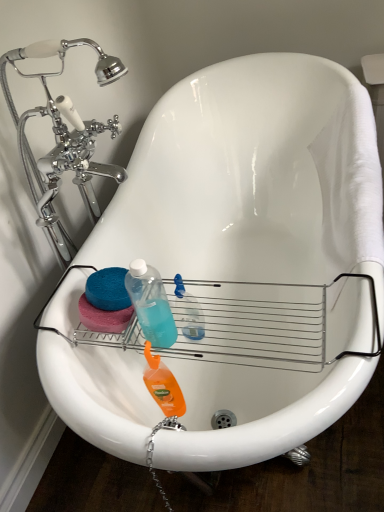
Where is `orange matte liquid at center, which is the second cleaning product in top-to-bottom order`? orange matte liquid at center, which is the second cleaning product in top-to-bottom order is located at coordinates (163, 385).

Describe the element at coordinates (163, 385) in the screenshot. I see `orange matte liquid at center, which is the first cleaning product from bottom to top` at that location.

Find the location of a particular element. Image resolution: width=384 pixels, height=512 pixels. translucent plastic bottle at center, marked as the 1th cleaning product in a top-to-bottom arrangement is located at coordinates (187, 312).

What do you see at coordinates (187, 312) in the screenshot?
I see `translucent plastic bottle at center, the 2th cleaning product in the bottom-to-top sequence` at bounding box center [187, 312].

Locate an element on the screen. Image resolution: width=384 pixels, height=512 pixels. orange matte liquid at center, which is the first cleaning product from bottom to top is located at coordinates (163, 385).

Considering the relative positions of translucent plastic bottle at center, the 2th cleaning product in the bottom-to-top sequence, and orange matte liquid at center, which is the first cleaning product from bottom to top, in the image provided, is translucent plastic bottle at center, the 2th cleaning product in the bottom-to-top sequence, to the right of orange matte liquid at center, which is the first cleaning product from bottom to top, from the viewer's perspective?

Yes, translucent plastic bottle at center, the 2th cleaning product in the bottom-to-top sequence, is to the right of orange matte liquid at center, which is the first cleaning product from bottom to top.

From the picture: Between translucent plastic bottle at center, the 2th cleaning product in the bottom-to-top sequence, and orange matte liquid at center, which is the first cleaning product from bottom to top, which one is positioned behind?

translucent plastic bottle at center, the 2th cleaning product in the bottom-to-top sequence.

Considering the positions of points (174, 298) and (159, 362), is point (174, 298) farther from camera compared to point (159, 362)?

No.

From the image's perspective, between translucent plastic bottle at center, the 2th cleaning product in the bottom-to-top sequence, and orange matte liquid at center, which is the second cleaning product in top-to-bottom order, which one is located above?

From the image's view, translucent plastic bottle at center, the 2th cleaning product in the bottom-to-top sequence, is above.

From a real-world perspective, is translucent plastic bottle at center, marked as the 1th cleaning product in a top-to-bottom arrangement, physically located above or below orange matte liquid at center, which is the second cleaning product in top-to-bottom order?

In terms of real-world spatial position, translucent plastic bottle at center, marked as the 1th cleaning product in a top-to-bottom arrangement, is above orange matte liquid at center, which is the second cleaning product in top-to-bottom order.

Is translucent plastic bottle at center, the 2th cleaning product in the bottom-to-top sequence, thinner than orange matte liquid at center, which is the second cleaning product in top-to-bottom order?

No, translucent plastic bottle at center, the 2th cleaning product in the bottom-to-top sequence, is not thinner than orange matte liquid at center, which is the second cleaning product in top-to-bottom order.

Is translucent plastic bottle at center, the 2th cleaning product in the bottom-to-top sequence, shorter than orange matte liquid at center, which is the first cleaning product from bottom to top?

Yes, translucent plastic bottle at center, the 2th cleaning product in the bottom-to-top sequence, is shorter than orange matte liquid at center, which is the first cleaning product from bottom to top.

Considering the sizes of objects translucent plastic bottle at center, the 2th cleaning product in the bottom-to-top sequence, and orange matte liquid at center, which is the first cleaning product from bottom to top, in the image provided, who is bigger, translucent plastic bottle at center, the 2th cleaning product in the bottom-to-top sequence, or orange matte liquid at center, which is the first cleaning product from bottom to top,?

With larger size is orange matte liquid at center, which is the first cleaning product from bottom to top.

Is orange matte liquid at center, which is the second cleaning product in top-to-bottom order, completely or partially inside translucent plastic bottle at center, the 2th cleaning product in the bottom-to-top sequence?

No.

Are translucent plastic bottle at center, marked as the 1th cleaning product in a top-to-bottom arrangement, and orange matte liquid at center, which is the first cleaning product from bottom to top, making contact?

No, translucent plastic bottle at center, marked as the 1th cleaning product in a top-to-bottom arrangement, is not next to orange matte liquid at center, which is the first cleaning product from bottom to top.

Is translucent plastic bottle at center, the 2th cleaning product in the bottom-to-top sequence, positioned with its back to orange matte liquid at center, which is the second cleaning product in top-to-bottom order?

That's not correct — translucent plastic bottle at center, the 2th cleaning product in the bottom-to-top sequence, is not looking away from orange matte liquid at center, which is the second cleaning product in top-to-bottom order.

How many degrees apart are the facing directions of translucent plastic bottle at center, marked as the 1th cleaning product in a top-to-bottom arrangement, and orange matte liquid at center, which is the second cleaning product in top-to-bottom order?

The angular difference between translucent plastic bottle at center, marked as the 1th cleaning product in a top-to-bottom arrangement, and orange matte liquid at center, which is the second cleaning product in top-to-bottom order, is 0.00082 degrees.

How distant is translucent plastic bottle at center, marked as the 1th cleaning product in a top-to-bottom arrangement, from orange matte liquid at center, which is the first cleaning product from bottom to top?

The distance of translucent plastic bottle at center, marked as the 1th cleaning product in a top-to-bottom arrangement, from orange matte liquid at center, which is the first cleaning product from bottom to top, is 7.06 inches.

The image size is (384, 512). Find the location of `cleaning product above the orange matte liquid at center, which is the first cleaning product from bottom to top (from a real-world perspective)`. cleaning product above the orange matte liquid at center, which is the first cleaning product from bottom to top (from a real-world perspective) is located at coordinates (187, 312).

Considering the positions of objects orange matte liquid at center, which is the first cleaning product from bottom to top, and translucent plastic bottle at center, marked as the 1th cleaning product in a top-to-bottom arrangement, in the image provided, who is more to the left, orange matte liquid at center, which is the first cleaning product from bottom to top, or translucent plastic bottle at center, marked as the 1th cleaning product in a top-to-bottom arrangement,?

orange matte liquid at center, which is the first cleaning product from bottom to top.

Which object is closer to the camera, orange matte liquid at center, which is the second cleaning product in top-to-bottom order, or translucent plastic bottle at center, marked as the 1th cleaning product in a top-to-bottom arrangement?

orange matte liquid at center, which is the second cleaning product in top-to-bottom order, is closer to the camera.

Considering the positions of points (163, 403) and (190, 328), is point (163, 403) closer to camera compared to point (190, 328)?

Yes, point (163, 403) is in front of point (190, 328).

From the image's perspective, which is above, orange matte liquid at center, which is the first cleaning product from bottom to top, or translucent plastic bottle at center, marked as the 1th cleaning product in a top-to-bottom arrangement?

translucent plastic bottle at center, marked as the 1th cleaning product in a top-to-bottom arrangement, from the image's perspective.

From a real-world perspective, is orange matte liquid at center, which is the second cleaning product in top-to-bottom order, positioned under translucent plastic bottle at center, the 2th cleaning product in the bottom-to-top sequence, based on gravity?

Yes, from a real-world perspective, orange matte liquid at center, which is the second cleaning product in top-to-bottom order, is below translucent plastic bottle at center, the 2th cleaning product in the bottom-to-top sequence.

Between orange matte liquid at center, which is the first cleaning product from bottom to top, and translucent plastic bottle at center, the 2th cleaning product in the bottom-to-top sequence, which one has larger width?

translucent plastic bottle at center, the 2th cleaning product in the bottom-to-top sequence.

Considering the relative sizes of orange matte liquid at center, which is the first cleaning product from bottom to top, and translucent plastic bottle at center, marked as the 1th cleaning product in a top-to-bottom arrangement, in the image provided, is orange matte liquid at center, which is the first cleaning product from bottom to top, shorter than translucent plastic bottle at center, marked as the 1th cleaning product in a top-to-bottom arrangement,?

No, orange matte liquid at center, which is the first cleaning product from bottom to top, is not shorter than translucent plastic bottle at center, marked as the 1th cleaning product in a top-to-bottom arrangement.

Considering the sizes of orange matte liquid at center, which is the first cleaning product from bottom to top, and translucent plastic bottle at center, marked as the 1th cleaning product in a top-to-bottom arrangement, in the image, is orange matte liquid at center, which is the first cleaning product from bottom to top, bigger or smaller than translucent plastic bottle at center, marked as the 1th cleaning product in a top-to-bottom arrangement,?

Considering their sizes, orange matte liquid at center, which is the first cleaning product from bottom to top, takes up more space than translucent plastic bottle at center, marked as the 1th cleaning product in a top-to-bottom arrangement.

From the picture: Is translucent plastic bottle at center, the 2th cleaning product in the bottom-to-top sequence, surrounded by orange matte liquid at center, which is the second cleaning product in top-to-bottom order?

That's incorrect, translucent plastic bottle at center, the 2th cleaning product in the bottom-to-top sequence, is not inside orange matte liquid at center, which is the second cleaning product in top-to-bottom order.

Are orange matte liquid at center, which is the second cleaning product in top-to-bottom order, and translucent plastic bottle at center, marked as the 1th cleaning product in a top-to-bottom arrangement, far apart?

No, orange matte liquid at center, which is the second cleaning product in top-to-bottom order, is not far from translucent plastic bottle at center, marked as the 1th cleaning product in a top-to-bottom arrangement.

Is orange matte liquid at center, which is the first cleaning product from bottom to top, facing away from translucent plastic bottle at center, the 2th cleaning product in the bottom-to-top sequence?

Yes, translucent plastic bottle at center, the 2th cleaning product in the bottom-to-top sequence, is at the back of orange matte liquid at center, which is the first cleaning product from bottom to top.

How far apart are orange matte liquid at center, which is the first cleaning product from bottom to top, and translucent plastic bottle at center, marked as the 1th cleaning product in a top-to-bottom arrangement?

orange matte liquid at center, which is the first cleaning product from bottom to top, and translucent plastic bottle at center, marked as the 1th cleaning product in a top-to-bottom arrangement, are 7.06 inches apart from each other.

You are a GUI agent. You are given a task and a screenshot of the screen. Output one action in this format:
    pyautogui.click(x=<x>, y=<y>)
    Task: Click on the cleaning product lying below the translucent plastic bottle at center, marked as the 1th cleaning product in a top-to-bottom arrangement (from the image's perspective)
    This screenshot has height=512, width=384.
    Given the screenshot: What is the action you would take?
    pyautogui.click(x=163, y=385)

Identify the location of cleaning product positioned vertically above the orange matte liquid at center, which is the second cleaning product in top-to-bottom order (from a real-world perspective). The width and height of the screenshot is (384, 512). (187, 312).

This screenshot has width=384, height=512. What are the coordinates of `cleaning product below the translucent plastic bottle at center, the 2th cleaning product in the bottom-to-top sequence (from a real-world perspective)` in the screenshot? It's located at (163, 385).